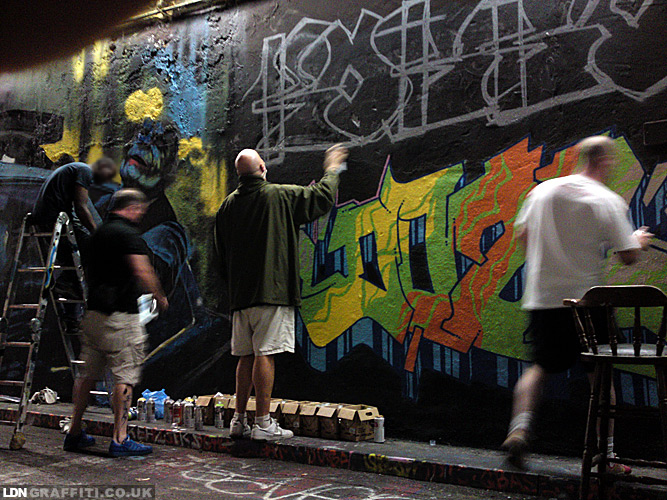
You are a GUI agent. You are given a task and a screenshot of the screen. Output one action in this format:
    pyautogui.click(x=<x>, y=<y>)
    Task: Click on the chair
    
    Given the screenshot: What is the action you would take?
    pyautogui.click(x=652, y=348)